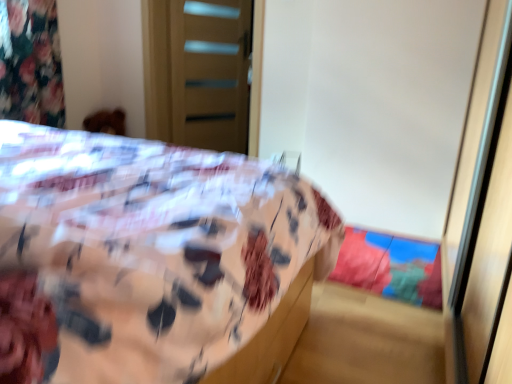
In the scene shown: Measure the distance between transparent plastic screen door at right, arranged as the 2th screen door when viewed from the back, and camera.

transparent plastic screen door at right, arranged as the 2th screen door when viewed from the back, and camera are 29.86 inches apart.

I want to click on transparent plastic screen door at right, the 1th screen door viewed from the front, so click(481, 208).

Considering the sizes of objects floral fabric bed at center and transparent plastic screen door at right, marked as the 1th screen door in a right-to-left arrangement, in the image provided, who is wider, floral fabric bed at center or transparent plastic screen door at right, marked as the 1th screen door in a right-to-left arrangement,?

floral fabric bed at center is wider.

Can you confirm if floral fabric bed at center is smaller than transparent plastic screen door at right, marked as the 1th screen door in a right-to-left arrangement?

No.

Can you tell me how much floral fabric bed at center and wooden door at upper center, which ranks as the 2th screen door in right-to-left order, differ in facing direction?

The angle between the facing direction of floral fabric bed at center and the facing direction of wooden door at upper center, which ranks as the 2th screen door in right-to-left order, is 115 degrees.

From a real-world perspective, who is located higher, floral fabric bed at center or wooden door at upper center, the first screen door when ordered from left to right?

In real-world perspective, wooden door at upper center, the first screen door when ordered from left to right, is above.

Is floral fabric bed at center turned away from wooden door at upper center, the second screen door when ordered from front to back?

floral fabric bed at center does not have its back to wooden door at upper center, the second screen door when ordered from front to back.

Between point (195, 220) and point (215, 53), which one is positioned in front?

The point (195, 220) is closer to the camera.

Could you tell me if wooden door at upper center, the first screen door when ordered from left to right, is facing floral fabric bed at center?

No, wooden door at upper center, the first screen door when ordered from left to right, is not facing towards floral fabric bed at center.

Considering the relative sizes of wooden door at upper center, the second screen door when ordered from front to back, and floral fabric bed at center in the image provided, is wooden door at upper center, the second screen door when ordered from front to back, bigger than floral fabric bed at center?

Incorrect, wooden door at upper center, the second screen door when ordered from front to back, is not larger than floral fabric bed at center.

Measure the distance from wooden door at upper center, placed as the first screen door when sorted from back to front, to transparent plastic screen door at right, arranged as the 2th screen door when viewed from the back.

wooden door at upper center, placed as the first screen door when sorted from back to front, and transparent plastic screen door at right, arranged as the 2th screen door when viewed from the back, are 2.41 meters apart from each other.

Is wooden door at upper center, the second screen door when ordered from front to back, wider or thinner than transparent plastic screen door at right, the 1th screen door viewed from the front?

Clearly, wooden door at upper center, the second screen door when ordered from front to back, has more width compared to transparent plastic screen door at right, the 1th screen door viewed from the front.

Is wooden door at upper center, the first screen door when ordered from left to right, further to the viewer compared to transparent plastic screen door at right, the 1th screen door viewed from the front?

That is True.

From the image's perspective, is transparent plastic screen door at right, the 1th screen door viewed from the front, located above or below floral fabric bed at center?

Based on their image positions, transparent plastic screen door at right, the 1th screen door viewed from the front, is located above floral fabric bed at center.

Is point (481, 260) in front of point (222, 353)?

No, it is not.

Considering the sizes of objects transparent plastic screen door at right, the 1th screen door viewed from the front, and floral fabric bed at center in the image provided, who is taller, transparent plastic screen door at right, the 1th screen door viewed from the front, or floral fabric bed at center?

transparent plastic screen door at right, the 1th screen door viewed from the front, is taller.

From a real-world perspective, which is physically below, transparent plastic screen door at right, the 1th screen door viewed from the front, or floral fabric bed at center?

floral fabric bed at center, from a real-world perspective.

Does transparent plastic screen door at right, the 1th screen door viewed from the front, have a larger size compared to wooden door at upper center, which ranks as the 2th screen door in right-to-left order?

No, transparent plastic screen door at right, the 1th screen door viewed from the front, is not bigger than wooden door at upper center, which ranks as the 2th screen door in right-to-left order.

From the image's perspective, relative to wooden door at upper center, placed as the first screen door when sorted from back to front, is transparent plastic screen door at right, the 1th screen door viewed from the front, above or below?

Based on their image positions, transparent plastic screen door at right, the 1th screen door viewed from the front, is located beneath wooden door at upper center, placed as the first screen door when sorted from back to front.

Can we say transparent plastic screen door at right, placed as the second screen door when sorted from left to right, lies outside wooden door at upper center, the second screen door when ordered from front to back?

transparent plastic screen door at right, placed as the second screen door when sorted from left to right, is positioned outside wooden door at upper center, the second screen door when ordered from front to back.

From the image's perspective, which screen door is the 1st one above the floral fabric bed at center? Please provide its 2D coordinates.

[(481, 208)]

You are a GUI agent. You are given a task and a screenshot of the screen. Output one action in this format:
    pyautogui.click(x=<x>, y=<y>)
    Task: Click on the bed that appears on the left of wooden door at upper center, the first screen door when ordered from left to right
    
    Given the screenshot: What is the action you would take?
    pyautogui.click(x=143, y=255)

From the image, which object appears to be nearer to wooden door at upper center, which ranks as the 2th screen door in right-to-left order, transparent plastic screen door at right, marked as the 1th screen door in a right-to-left arrangement, or floral fabric bed at center?

The object closer to wooden door at upper center, which ranks as the 2th screen door in right-to-left order, is floral fabric bed at center.

Based on their spatial positions, is wooden door at upper center, the second screen door when ordered from front to back, or floral fabric bed at center further from transparent plastic screen door at right, the 1th screen door viewed from the front?

Among the two, wooden door at upper center, the second screen door when ordered from front to back, is located further to transparent plastic screen door at right, the 1th screen door viewed from the front.

When comparing their distances from transparent plastic screen door at right, marked as the 1th screen door in a right-to-left arrangement, does floral fabric bed at center or wooden door at upper center, which ranks as the 2th screen door in right-to-left order, seem closer?

The object closer to transparent plastic screen door at right, marked as the 1th screen door in a right-to-left arrangement, is floral fabric bed at center.

When comparing their distances from floral fabric bed at center, does transparent plastic screen door at right, placed as the second screen door when sorted from left to right, or wooden door at upper center, placed as the first screen door when sorted from back to front, seem closer?

transparent plastic screen door at right, placed as the second screen door when sorted from left to right, is positioned closer to the anchor floral fabric bed at center.

Looking at this image, when comparing their distances from floral fabric bed at center, does wooden door at upper center, the second screen door when ordered from front to back, or transparent plastic screen door at right, placed as the second screen door when sorted from left to right, seem closer?

transparent plastic screen door at right, placed as the second screen door when sorted from left to right, is positioned closer to the anchor floral fabric bed at center.

When comparing their distances from wooden door at upper center, placed as the first screen door when sorted from back to front, does floral fabric bed at center or transparent plastic screen door at right, the 1th screen door viewed from the front, seem further?

transparent plastic screen door at right, the 1th screen door viewed from the front, is positioned further to the anchor wooden door at upper center, placed as the first screen door when sorted from back to front.

This screenshot has width=512, height=384. Identify the location of screen door positioned between floral fabric bed at center and wooden door at upper center, placed as the first screen door when sorted from back to front, from near to far. (481, 208).